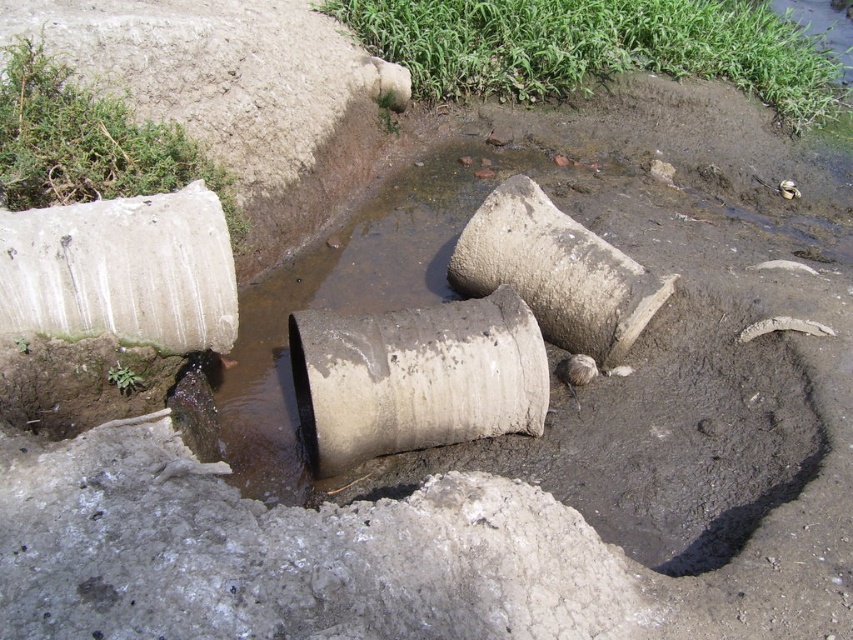
You are a maintenance worker inspecting the drainage system. You see the muddy concrete pipe at center and the gray concrete water pipe at center. Which one is positioned to the left?

The muddy concrete pipe at center is positioned to the left of the gray concrete water pipe at center.